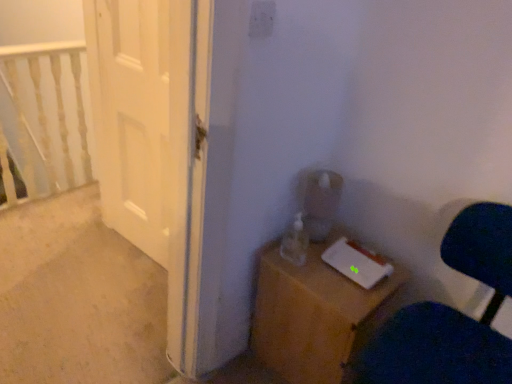
Question: From a real-world perspective, does velvet dark blue chair at lower right sit lower than white painted wood railing at upper left?

Choices:
 (A) no
 (B) yes

Answer: (B)

Question: Is velvet dark blue chair at lower right taller than white painted wood railing at upper left?

Choices:
 (A) no
 (B) yes

Answer: (A)

Question: Is velvet dark blue chair at lower right in contact with white painted wood railing at upper left?

Choices:
 (A) no
 (B) yes

Answer: (A)

Question: Is velvet dark blue chair at lower right oriented towards white painted wood railing at upper left?

Choices:
 (A) no
 (B) yes

Answer: (A)

Question: Is velvet dark blue chair at lower right at the right side of white painted wood railing at upper left?

Choices:
 (A) no
 (B) yes

Answer: (B)

Question: From a real-world perspective, is white painted wood railing at upper left physically located above or below velvet dark blue chair at lower right?

Choices:
 (A) above
 (B) below

Answer: (A)

Question: From the image's perspective, is white painted wood railing at upper left above or below velvet dark blue chair at lower right?

Choices:
 (A) above
 (B) below

Answer: (A)

Question: Visually, is white painted wood railing at upper left positioned to the left or to the right of velvet dark blue chair at lower right?

Choices:
 (A) right
 (B) left

Answer: (B)

Question: Is point (34, 61) positioned closer to the camera than point (436, 355)?

Choices:
 (A) farther
 (B) closer

Answer: (A)

Question: Is wooden nightstand at lower right inside or outside of white glossy door at left?

Choices:
 (A) outside
 (B) inside

Answer: (A)

Question: In the image, is wooden nightstand at lower right positioned in front of or behind white glossy door at left?

Choices:
 (A) behind
 (B) front

Answer: (B)

Question: From the image's perspective, is wooden nightstand at lower right above or below white glossy door at left?

Choices:
 (A) above
 (B) below

Answer: (B)

Question: Based on their positions, is wooden nightstand at lower right located to the left or right of white glossy door at left?

Choices:
 (A) left
 (B) right

Answer: (B)

Question: Based on their sizes in the image, would you say white glossy door at left is bigger or smaller than white painted wood railing at upper left?

Choices:
 (A) small
 (B) big

Answer: (A)

Question: Is white glossy door at left situated inside white painted wood railing at upper left or outside?

Choices:
 (A) outside
 (B) inside

Answer: (A)